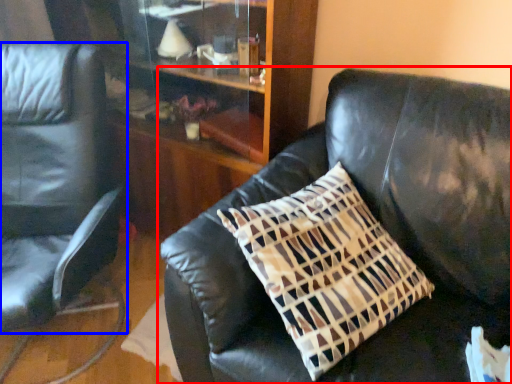
Question: Which object appears farthest to the camera in this image, studio couch (highlighted by a red box) or chair (highlighted by a blue box)?

Choices:
 (A) studio couch
 (B) chair

Answer: (B)